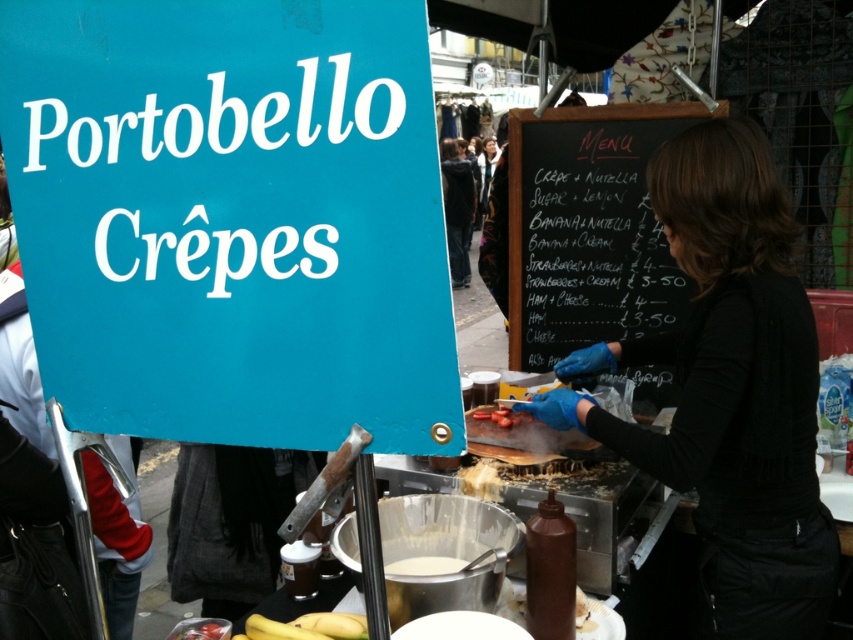
Question: Which of the following is the closest to the observer?

Choices:
 (A) black chalkboard menu at center
 (B) white matte batter at center

Answer: (B)

Question: Which point appears farthest from the camera in this image?

Choices:
 (A) (392, 572)
 (B) (502, 426)
 (C) (721, 524)

Answer: (B)

Question: Is white matte batter at center above smooth tomato at center?

Choices:
 (A) yes
 (B) no

Answer: (B)

Question: Does black fabric at center have a smaller size compared to smooth tomato at center?

Choices:
 (A) yes
 (B) no

Answer: (B)

Question: Which point appears closest to the camera in this image?

Choices:
 (A) (573, 170)
 (B) (454, 557)
 (C) (782, 497)
 (D) (503, 422)

Answer: (C)

Question: Is black fabric at center smaller than white matte batter at center?

Choices:
 (A) no
 (B) yes

Answer: (A)